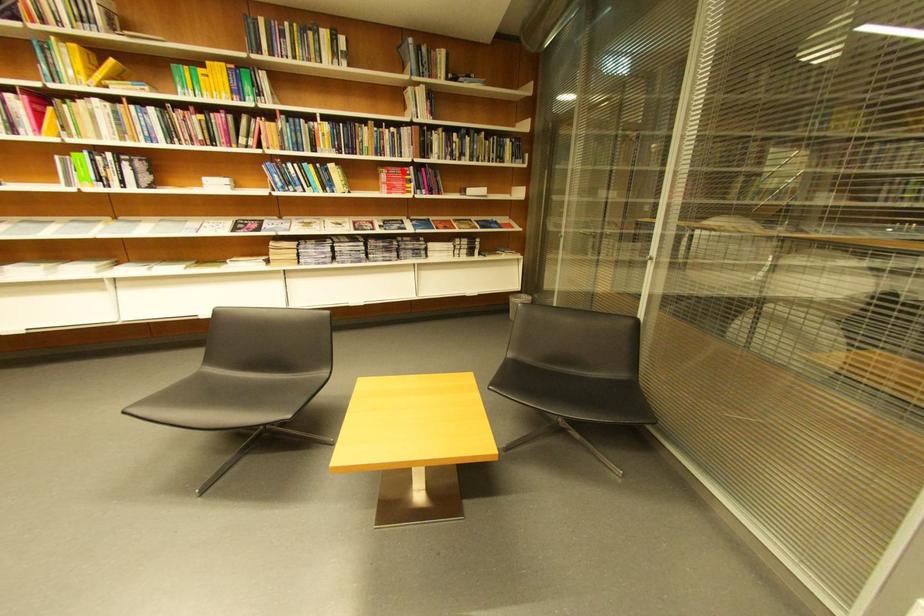
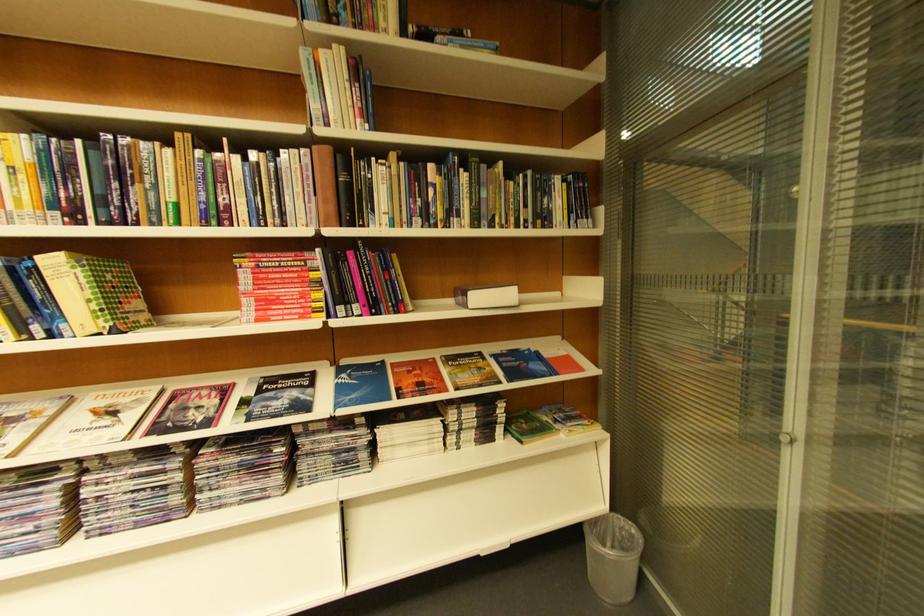
Find the pixel in the second image that matches the highlighted location in the first image.

(281, 262)